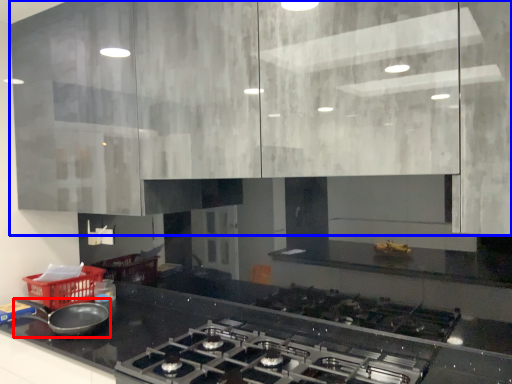
Question: Which object is further to the camera taking this photo, kitchen appliance (highlighted by a red box) or cabinetry (highlighted by a blue box)?

Choices:
 (A) kitchen appliance
 (B) cabinetry

Answer: (A)